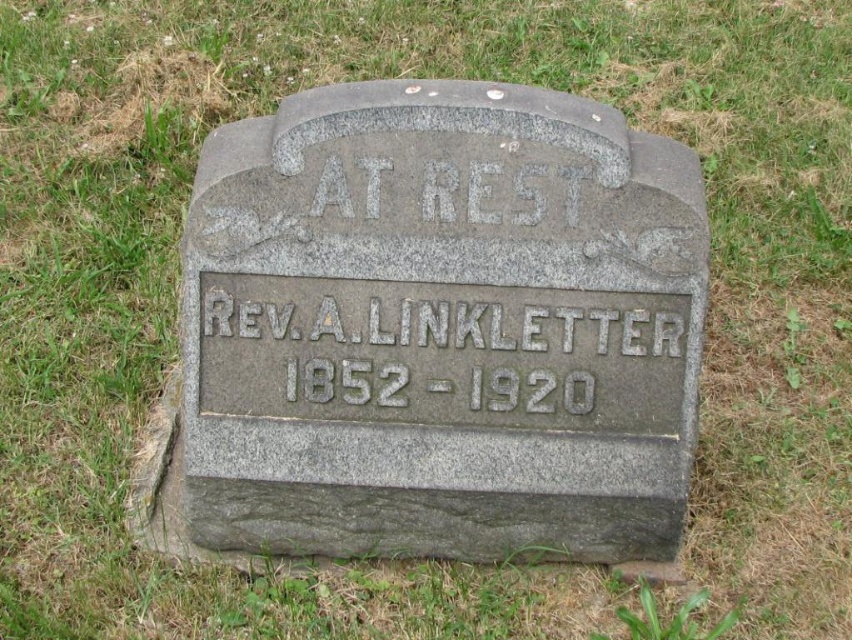
Does gray stone gravestone at center have a greater width compared to gray granite inscription at center?

Correct, the width of gray stone gravestone at center exceeds that of gray granite inscription at center.

What are the coordinates of `gray stone gravestone at center` in the screenshot? It's located at (441, 326).